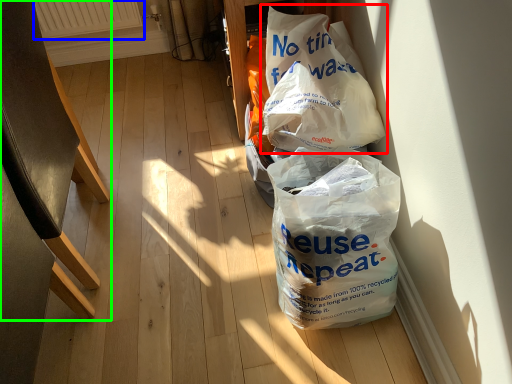
Question: Which object is positioned farthest from plastic bag (highlighted by a red box)? Select from radiator (highlighted by a blue box) and furniture (highlighted by a green box).

Choices:
 (A) radiator
 (B) furniture

Answer: (A)